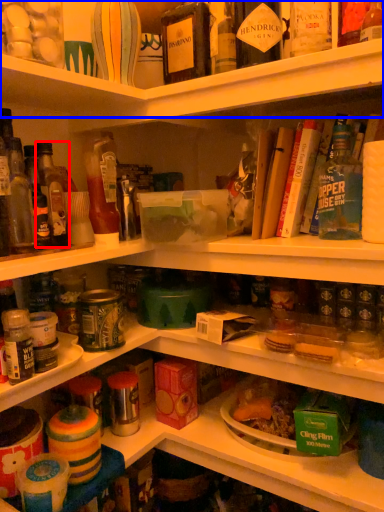
Question: Which object appears closest to the camera in this image, bottle (highlighted by a red box) or shelf (highlighted by a blue box)?

Choices:
 (A) bottle
 (B) shelf

Answer: (B)